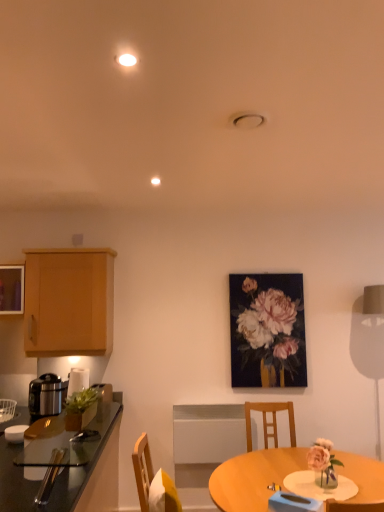
What is the approximate height of matte black table lamp at right?

matte black table lamp at right is 1.38 meters in height.

This screenshot has width=384, height=512. What do you see at coordinates (267, 330) in the screenshot?
I see `metallic gold picture frame at center` at bounding box center [267, 330].

Where is `metallic silver rice cooker at left`? The width and height of the screenshot is (384, 512). metallic silver rice cooker at left is located at coordinates (47, 395).

What do you see at coordinates (253, 477) in the screenshot?
I see `light wood table at center` at bounding box center [253, 477].

Identify the location of light wood table at center. (253, 477).

What do you see at coordinates (69, 302) in the screenshot? I see `light brown wood cabinet at left` at bounding box center [69, 302].

You are a GUI agent. You are given a task and a screenshot of the screen. Output one action in this format:
    pyautogui.click(x=<x>, y=<y>)
    Task: Click on the matte black table lamp at right
    The height and width of the screenshot is (512, 384).
    Given the screenshot: What is the action you would take?
    pyautogui.click(x=369, y=342)

Are light wood table at center and light brown wood cabinet at left beside each other?

They are not placed beside each other.

Which is in front, light wood table at center or light brown wood cabinet at left?

light wood table at center is in front.

Which of these two, light wood table at center or light brown wood cabinet at left, is smaller?

With smaller size is light brown wood cabinet at left.

Between point (354, 474) and point (84, 283), which one is positioned behind?

The point (84, 283) is behind.

Looking at their sizes, would you say matte black table lamp at right is wider or thinner than light brown wood cabinet at left?

In the image, matte black table lamp at right appears to be more narrow than light brown wood cabinet at left.

Can you confirm if matte black table lamp at right is bigger than light brown wood cabinet at left?

No, matte black table lamp at right is not bigger than light brown wood cabinet at left.

Which is more to the left, matte black table lamp at right or light brown wood cabinet at left?

light brown wood cabinet at left is more to the left.

Which point is more distant from viewer, (374,378) or (107,351)?

Point (374,378)

Is metallic gold picture frame at center taller than matte black table lamp at right?

No.

Between metallic gold picture frame at center and matte black table lamp at right, which one has larger width?

matte black table lamp at right is wider.

From the image's perspective, would you say metallic gold picture frame at center is shown under matte black table lamp at right?

Incorrect, from the image's perspective, metallic gold picture frame at center is higher than matte black table lamp at right.

How many degrees apart are the facing directions of light wood table at center and shiny black countertop at left?

light wood table at center and shiny black countertop at left are facing 179 degrees away from each other.

Which is more to the right, light wood table at center or shiny black countertop at left?

From the viewer's perspective, light wood table at center appears more on the right side.

Does light wood table at center have a larger size compared to shiny black countertop at left?

No, light wood table at center is not bigger than shiny black countertop at left.

Is point (223, 480) closer to viewer compared to point (74, 488)?

No, it is not.

From the image's perspective, which is below, metallic silver rice cooker at left or metallic gold picture frame at center?

From the image's view, metallic silver rice cooker at left is below.

Can you confirm if metallic silver rice cooker at left is taller than metallic gold picture frame at center?

No.

Is metallic silver rice cooker at left completely or partially outside of metallic gold picture frame at center?

Result: metallic silver rice cooker at left is positioned outside metallic gold picture frame at center.

Who is smaller, light brown wood cabinet at left or matte black table lamp at right?

With smaller size is matte black table lamp at right.

From the image's perspective, who appears lower, light brown wood cabinet at left or matte black table lamp at right?

matte black table lamp at right appears lower in the image.

Considering the relative positions of light brown wood cabinet at left and matte black table lamp at right in the image provided, is light brown wood cabinet at left behind matte black table lamp at right?

Yes, light brown wood cabinet at left is further from the camera.

In the image, is light brown wood cabinet at left on the left side or the right side of matte black table lamp at right?

light brown wood cabinet at left is to the left of matte black table lamp at right.

Based on their positions, is metallic silver rice cooker at left located to the left or right of light brown wood cabinet at left?

metallic silver rice cooker at left is positioned on light brown wood cabinet at left's left side.

Is metallic silver rice cooker at left directly adjacent to light brown wood cabinet at left?

No, metallic silver rice cooker at left is not with light brown wood cabinet at left.

From a real-world perspective, is metallic silver rice cooker at left physically below light brown wood cabinet at left?

Yes, from a real-world perspective, metallic silver rice cooker at left is beneath light brown wood cabinet at left.

Is metallic silver rice cooker at left positioned with its back to light brown wood cabinet at left?

No, metallic silver rice cooker at left's orientation is not away from light brown wood cabinet at left.

Where is `cabinetry on the left of the light wood table at center`? The height and width of the screenshot is (512, 384). cabinetry on the left of the light wood table at center is located at coordinates (69, 302).

The image size is (384, 512). I want to click on cabinetry that appears above the matte black table lamp at right (from a real-world perspective), so click(x=69, y=302).

From the image, which object appears to be farther from shiny black countertop at left, light wood table at center or matte black table lamp at right?

matte black table lamp at right.

From the image, which object appears to be farther from metallic gold picture frame at center, matte black table lamp at right or shiny black countertop at left?

shiny black countertop at left.

From the image, which object appears to be farther from light wood table at center, light brown wood cabinet at left or metallic silver rice cooker at left?

light brown wood cabinet at left is positioned further to the anchor light wood table at center.

When comparing their distances from shiny black countertop at left, does metallic gold picture frame at center or matte black table lamp at right seem closer?

Based on the image, metallic gold picture frame at center appears to be nearer to shiny black countertop at left.

When comparing their distances from light wood table at center, does metallic gold picture frame at center or shiny black countertop at left seem closer?

shiny black countertop at left.

Estimate the real-world distances between objects in this image. Which object is further from metallic silver rice cooker at left, matte black table lamp at right or light brown wood cabinet at left?

Based on the image, matte black table lamp at right appears to be further to metallic silver rice cooker at left.

Considering their positions, is matte black table lamp at right positioned closer to metallic silver rice cooker at left than light wood table at center?

The object closer to metallic silver rice cooker at left is light wood table at center.

Which object lies nearer to the anchor point light wood table at center, matte black table lamp at right or metallic silver rice cooker at left?

matte black table lamp at right is positioned closer to the anchor light wood table at center.

Find the location of a particular element. The width and height of the screenshot is (384, 512). kitchen appliance between shiny black countertop at left and metallic gold picture frame at center along the z-axis is located at coordinates (47, 395).

Where is `countertop between metallic silver rice cooker at left and light wood table at center`? The height and width of the screenshot is (512, 384). countertop between metallic silver rice cooker at left and light wood table at center is located at coordinates (57, 477).

Find the location of `picture frame located between shiny black countertop at left and matte black table lamp at right in the left-right direction`. picture frame located between shiny black countertop at left and matte black table lamp at right in the left-right direction is located at coordinates (267, 330).

Image resolution: width=384 pixels, height=512 pixels. In order to click on countertop located between light brown wood cabinet at left and matte black table lamp at right in the left-right direction in this screenshot , I will do `click(57, 477)`.